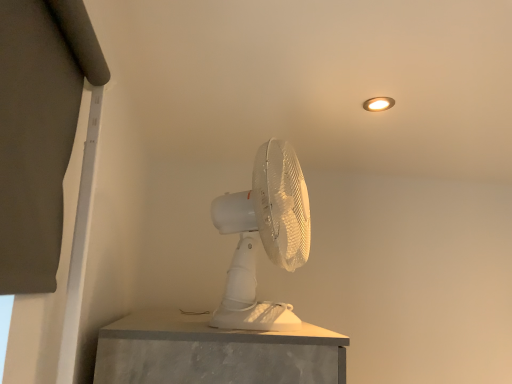
At what (x,y) coordinates should I click in order to perform the action: click on free area behind matte white light fixture at upper right. Please return your answer as a coordinate pair (x, y). The width and height of the screenshot is (512, 384). Looking at the image, I should click on (361, 122).